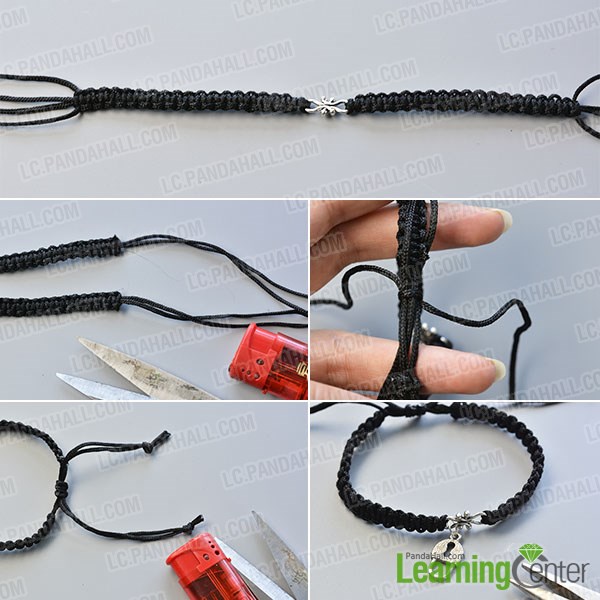
Where is `lock`? The height and width of the screenshot is (600, 600). lock is located at coordinates (446, 542).